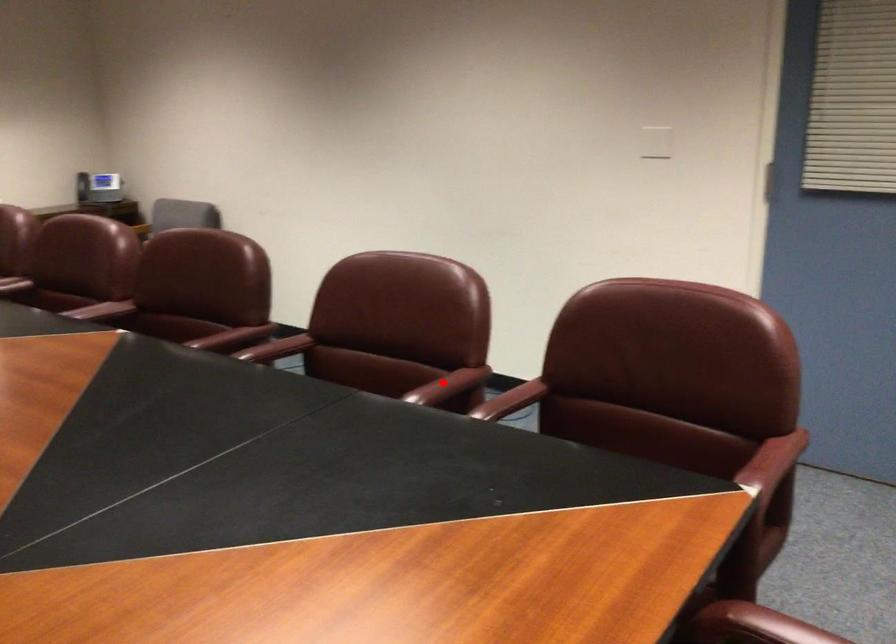
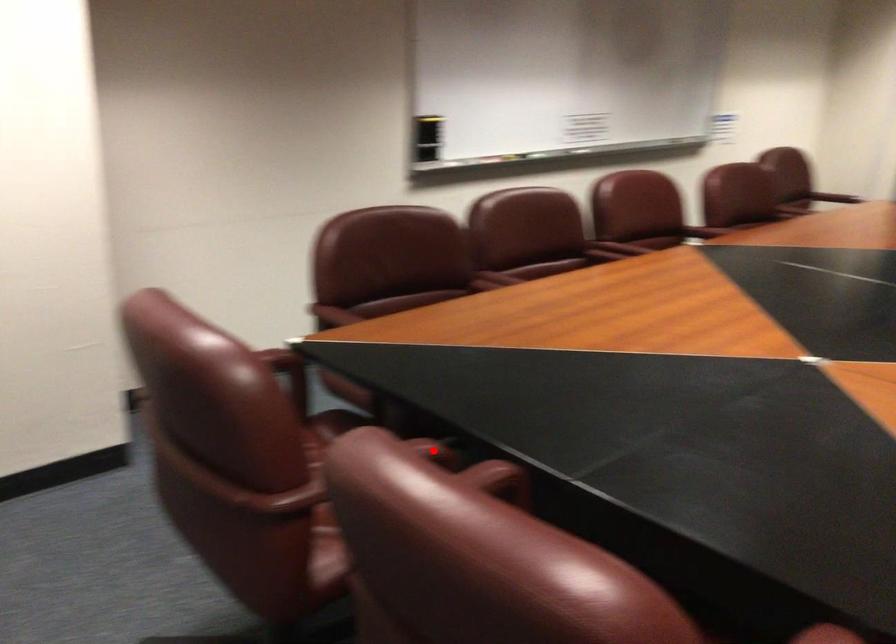
I am providing you with two images of the same scene from different viewpoints. A red point is marked on the first image and another point is marked on the second image. Is the marked point in image1 the same physical position as the marked point in image2?

No